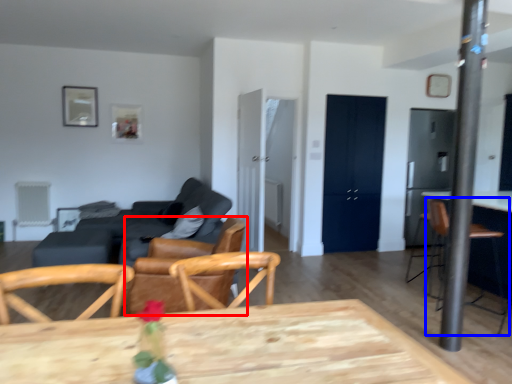
Question: Which of the following is the farthest to the observer, chair (highlighted by a red box) or armchair (highlighted by a blue box)?

Choices:
 (A) chair
 (B) armchair

Answer: (B)